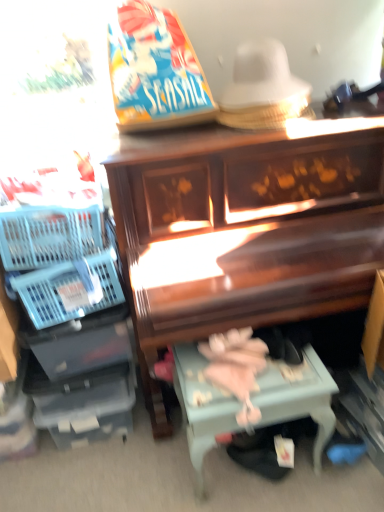
Question: Which direction should I rotate to look at light blue painted wood table at lower center?

Choices:
 (A) right
 (B) left

Answer: (A)

Question: From the image's perspective, is wooden piano at center located above light blue painted wood table at lower center?

Choices:
 (A) yes
 (B) no

Answer: (A)

Question: Is wooden piano at center beside light blue painted wood table at lower center?

Choices:
 (A) no
 (B) yes

Answer: (A)

Question: Does wooden piano at center have a lesser height compared to light blue painted wood table at lower center?

Choices:
 (A) no
 (B) yes

Answer: (A)

Question: Does wooden piano at center have a greater width compared to light blue painted wood table at lower center?

Choices:
 (A) no
 (B) yes

Answer: (B)

Question: Is light blue painted wood table at lower center a part of wooden piano at center?

Choices:
 (A) yes
 (B) no

Answer: (A)

Question: Considering the relative positions of wooden piano at center and light blue painted wood table at lower center in the image provided, is wooden piano at center to the left of light blue painted wood table at lower center from the viewer's perspective?

Choices:
 (A) no
 (B) yes

Answer: (A)

Question: From the image's perspective, does wooden piano at center appear higher than blue plastic basket at left?

Choices:
 (A) yes
 (B) no

Answer: (B)

Question: Considering the relative sizes of wooden piano at center and blue plastic basket at left in the image provided, is wooden piano at center thinner than blue plastic basket at left?

Choices:
 (A) no
 (B) yes

Answer: (A)

Question: Can you confirm if wooden piano at center is taller than blue plastic basket at left?

Choices:
 (A) no
 (B) yes

Answer: (B)

Question: Would you say wooden piano at center contains blue plastic basket at left?

Choices:
 (A) no
 (B) yes

Answer: (A)

Question: Is wooden piano at center looking in the opposite direction of blue plastic basket at left?

Choices:
 (A) yes
 (B) no

Answer: (B)

Question: From a real-world perspective, is wooden piano at center beneath blue plastic basket at left?

Choices:
 (A) yes
 (B) no

Answer: (A)

Question: Is blue plastic basket at left next to light blue painted wood table at lower center?

Choices:
 (A) no
 (B) yes

Answer: (A)